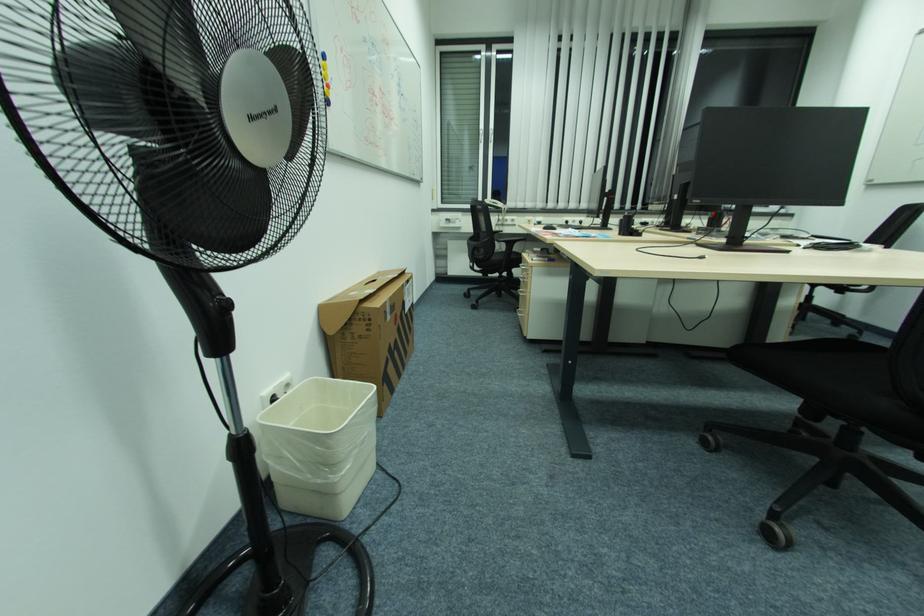
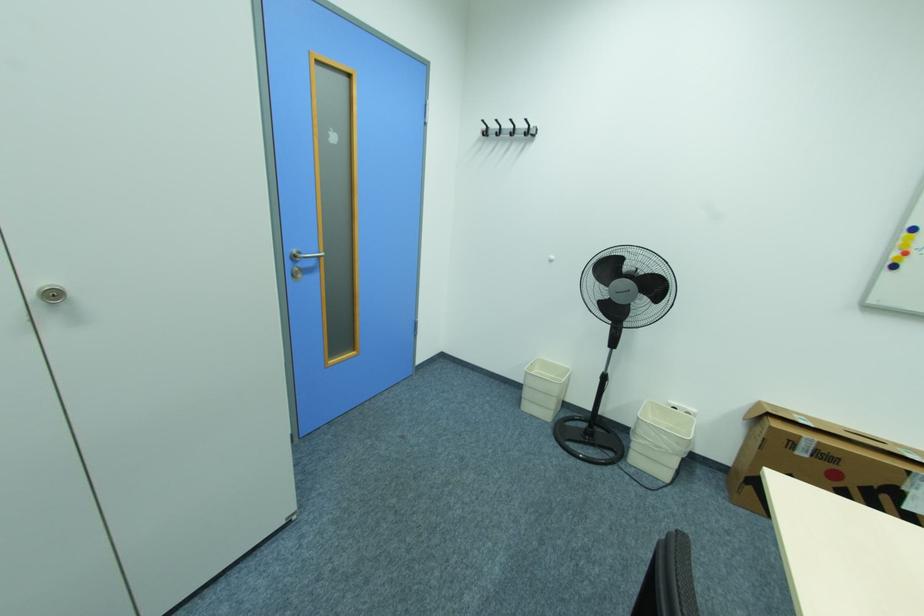
Find the pixel in the second image that matches [278,398] in the first image.

(679, 408)